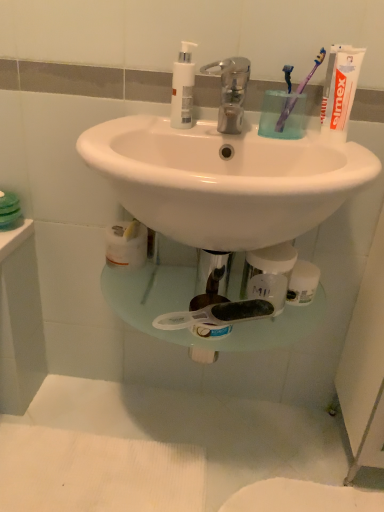
Question: Is purple plastic toothbrush at upper right, placed as the 1th toothbrush when sorted from left to right, taller than purple plastic toothbrush at upper right, the first toothbrush in the right-to-left sequence?

Choices:
 (A) no
 (B) yes

Answer: (A)

Question: Is purple plastic toothbrush at upper right, placed as the 1th toothbrush when sorted from left to right, closer to camera compared to purple plastic toothbrush at upper right, the first toothbrush in the right-to-left sequence?

Choices:
 (A) yes
 (B) no

Answer: (B)

Question: Is purple plastic toothbrush at upper right, positioned as the second toothbrush in right-to-left order, bigger than purple plastic toothbrush at upper right, which is counted as the second toothbrush, starting from the left?

Choices:
 (A) yes
 (B) no

Answer: (B)

Question: From the image's perspective, is purple plastic toothbrush at upper right, positioned as the second toothbrush in right-to-left order, on top of purple plastic toothbrush at upper right, the first toothbrush in the right-to-left sequence?

Choices:
 (A) yes
 (B) no

Answer: (B)

Question: Does purple plastic toothbrush at upper right, positioned as the second toothbrush in right-to-left order, contain purple plastic toothbrush at upper right, which is counted as the second toothbrush, starting from the left?

Choices:
 (A) yes
 (B) no

Answer: (B)

Question: From a real-world perspective, is purple plastic toothbrush at upper right, placed as the 1th toothbrush when sorted from left to right, over purple plastic toothbrush at upper right, which is counted as the second toothbrush, starting from the left?

Choices:
 (A) yes
 (B) no

Answer: (B)

Question: Is metallic faucet at center shorter than purple plastic toothbrush at upper right, the first toothbrush in the right-to-left sequence?

Choices:
 (A) no
 (B) yes

Answer: (B)

Question: Can you confirm if metallic faucet at center is bigger than purple plastic toothbrush at upper right, which is counted as the second toothbrush, starting from the left?

Choices:
 (A) no
 (B) yes

Answer: (B)

Question: Is metallic faucet at center thinner than purple plastic toothbrush at upper right, which is counted as the second toothbrush, starting from the left?

Choices:
 (A) yes
 (B) no

Answer: (B)

Question: Considering the relative positions of metallic faucet at center and purple plastic toothbrush at upper right, the first toothbrush in the right-to-left sequence, in the image provided, is metallic faucet at center to the right of purple plastic toothbrush at upper right, the first toothbrush in the right-to-left sequence, from the viewer's perspective?

Choices:
 (A) no
 (B) yes

Answer: (A)

Question: From the image's perspective, is metallic faucet at center below purple plastic toothbrush at upper right, the first toothbrush in the right-to-left sequence?

Choices:
 (A) yes
 (B) no

Answer: (A)

Question: Is metallic faucet at center outside of purple plastic toothbrush at upper right, which is counted as the second toothbrush, starting from the left?

Choices:
 (A) no
 (B) yes

Answer: (B)

Question: Is white matte toothpaste at upper right further to camera compared to purple plastic toothbrush at upper right, positioned as the second toothbrush in right-to-left order?

Choices:
 (A) no
 (B) yes

Answer: (A)